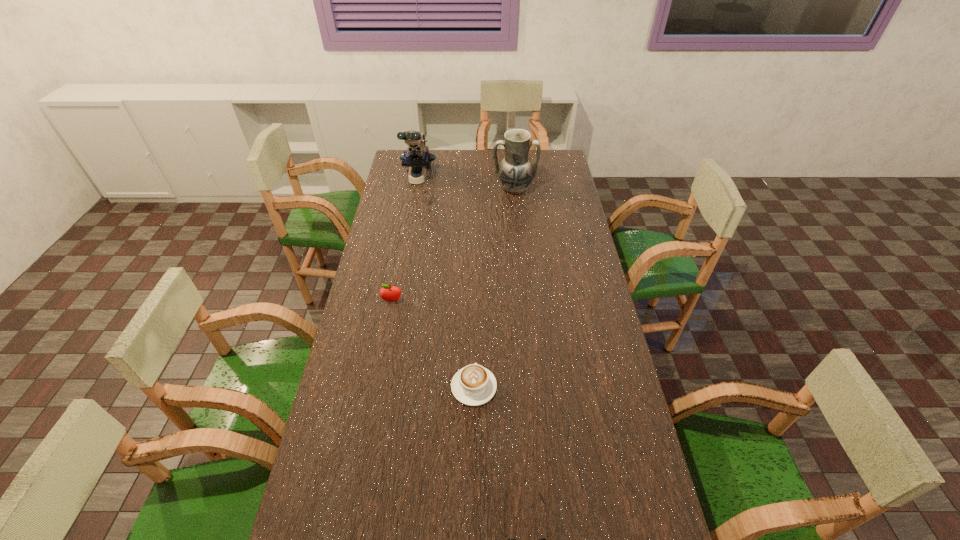
The image size is (960, 540). I want to click on free space between the microscope and the pitcher, so click(466, 183).

The width and height of the screenshot is (960, 540). Identify the location of vacant point located between the third farthest object and the third object from left to right. (433, 344).

This screenshot has width=960, height=540. I want to click on empty location between the apple and the microscope, so click(405, 240).

The image size is (960, 540). What are the coordinates of `empty space between the pitcher and the fourth farthest object` in the screenshot? It's located at (494, 287).

You are a GUI agent. You are given a task and a screenshot of the screen. Output one action in this format:
    pyautogui.click(x=<x>, y=<y>)
    Task: Click on the free area in between the apple and the pitcher
    Image resolution: width=960 pixels, height=540 pixels.
    Given the screenshot: What is the action you would take?
    pyautogui.click(x=453, y=245)

This screenshot has width=960, height=540. What are the coordinates of `the second closest object to the third object from left to right` in the screenshot? It's located at (x=391, y=294).

Where is `object that ranks as the closest to the fourth farthest object`? object that ranks as the closest to the fourth farthest object is located at coordinates (509, 539).